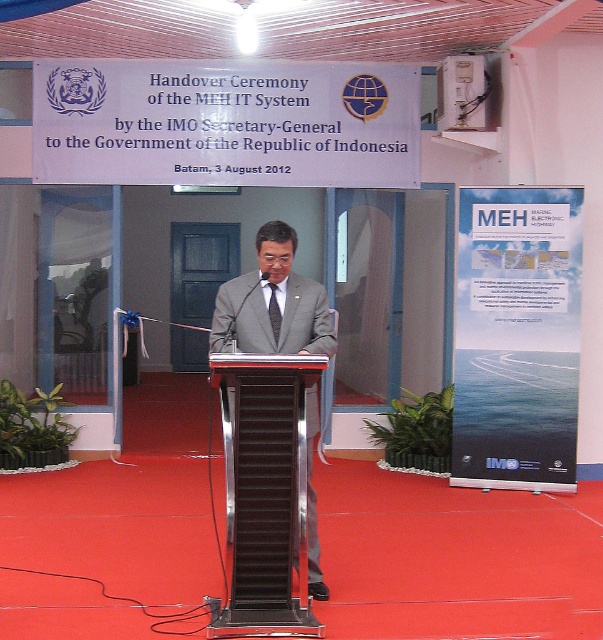
From the picture: Who is higher up, gray suit at center or black textured tie at center?

black textured tie at center

Can you confirm if gray suit at center is positioned above black textured tie at center?

Actually, gray suit at center is below black textured tie at center.

You are a GUI agent. You are given a task and a screenshot of the screen. Output one action in this format:
    pyautogui.click(x=<x>, y=<y>)
    Task: Click on the gray suit at center
    The width and height of the screenshot is (603, 640).
    Given the screenshot: What is the action you would take?
    pyautogui.click(x=267, y=304)

Image resolution: width=603 pixels, height=640 pixels. What do you see at coordinates (516, 337) in the screenshot?
I see `blue paperboard poster at center` at bounding box center [516, 337].

In the scene shown: Does blue paperboard poster at center appear under black textured tie at center?

Yes.

Who is more distant from viewer, (487, 273) or (271, 294)?

Positioned behind is point (487, 273).

This screenshot has height=640, width=603. I want to click on blue paperboard poster at center, so click(516, 337).

Looking at this image, does blue paperboard poster at center appear on the left side of gray suit at center?

No, blue paperboard poster at center is not to the left of gray suit at center.

Is blue paperboard poster at center closer to camera compared to gray suit at center?

No.

Is point (458, 264) farther from viewer compared to point (218, 340)?

Yes, it is behind point (218, 340).

Where is `blue paperboard poster at center`? The image size is (603, 640). blue paperboard poster at center is located at coordinates (516, 337).